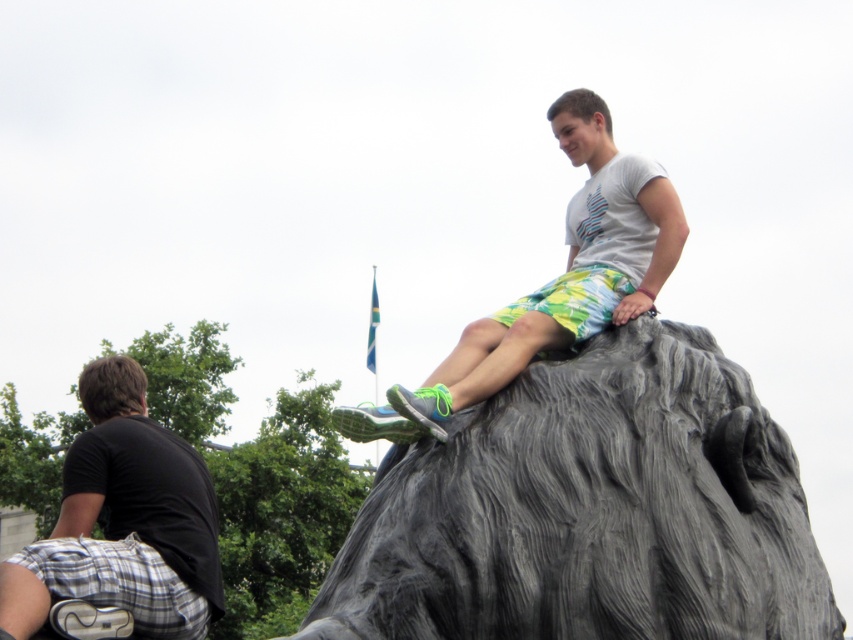
Can you confirm if black cotton shirt at lower left is shorter than light gray stone statue at upper center?

Indeed, black cotton shirt at lower left has a lesser height compared to light gray stone statue at upper center.

Which is in front, point (78, 468) or point (527, 310)?

Point (527, 310) is in front.

Which is in front, point (123, 584) or point (360, 419)?

Positioned in front is point (360, 419).

The image size is (853, 640). What are the coordinates of `black cotton shirt at lower left` in the screenshot? It's located at (123, 522).

Who is higher up, gray textured rock at upper center or light gray stone statue at upper center?

light gray stone statue at upper center is higher up.

Is point (473, 604) closer to camera compared to point (592, 244)?

That is True.

Locate an element on the screen. This screenshot has width=853, height=640. gray textured rock at upper center is located at coordinates (590, 509).

Can you confirm if gray textured rock at upper center is positioned below black cotton shirt at lower left?

Incorrect, gray textured rock at upper center is not positioned below black cotton shirt at lower left.

Is gray textured rock at upper center thinner than black cotton shirt at lower left?

Incorrect, gray textured rock at upper center's width is not less than black cotton shirt at lower left's.

Does point (762, 609) come behind point (161, 538)?

No.

This screenshot has width=853, height=640. In order to click on gray textured rock at upper center in this screenshot , I will do `click(590, 509)`.